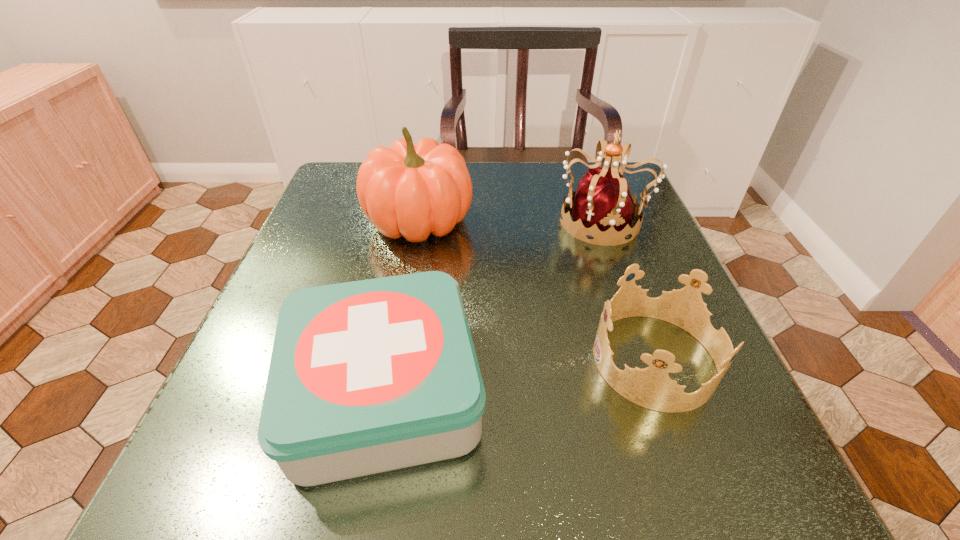
Locate an element on the screen. pumpkin is located at coordinates (411, 191).

In order to click on the farther tiara in this screenshot , I will do `click(603, 209)`.

I want to click on the shorter tiara, so click(x=651, y=387).

This screenshot has width=960, height=540. What are the coordinates of `the first-aid kit` in the screenshot? It's located at (369, 376).

This screenshot has height=540, width=960. I want to click on free spot located 0.280m on the front of the pumpkin, so click(x=393, y=372).

Locate an element on the screen. This screenshot has width=960, height=540. vacant point located 0.110m on the front-facing side of the taller tiara is located at coordinates (506, 221).

This screenshot has width=960, height=540. I want to click on free space located 0.260m on the front-facing side of the taller tiara, so click(x=438, y=221).

Image resolution: width=960 pixels, height=540 pixels. What are the coordinates of `free space located 0.360m on the front-facing side of the taller tiara` in the screenshot? It's located at (392, 221).

You are a GUI agent. You are given a task and a screenshot of the screen. Output one action in this format:
    pyautogui.click(x=<x>, y=<y>)
    Task: Click on the vacant region located 0.330m on the front-facing side of the shorter tiara
    Image resolution: width=960 pixels, height=540 pixels.
    Given the screenshot: What is the action you would take?
    pyautogui.click(x=382, y=360)

Where is `blank space located 0.060m on the front-facing side of the shorter tiara`? The height and width of the screenshot is (540, 960). blank space located 0.060m on the front-facing side of the shorter tiara is located at coordinates (556, 360).